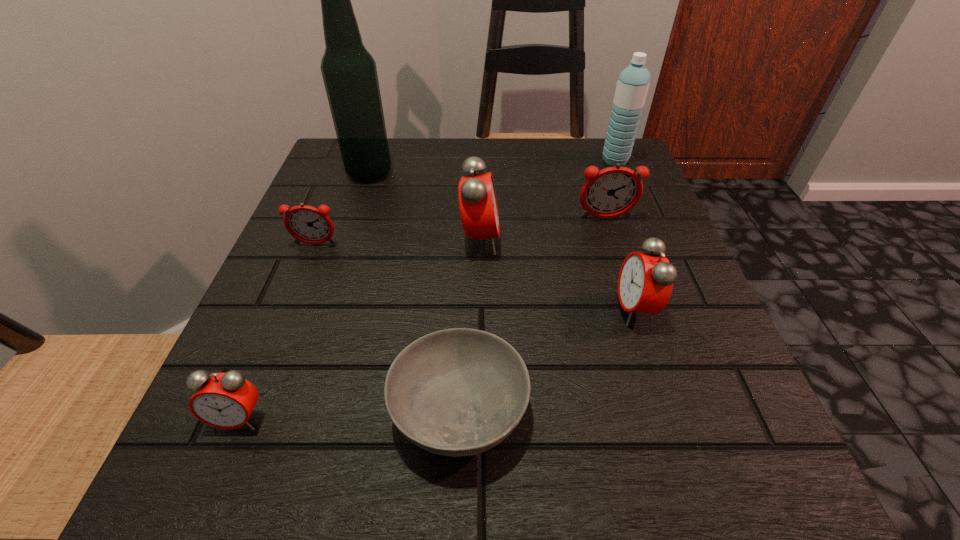
Locate an element on the screen. vacant position located 0.280m on the front-facing side of the third nearest object is located at coordinates (440, 309).

The height and width of the screenshot is (540, 960). Identify the location of vacant area situated 0.090m on the front-facing side of the third nearest object. (560, 309).

I want to click on blank space located 0.170m on the front-facing side of the nearer reddish-pink alarm clock, so click(x=285, y=321).

You are a GUI agent. You are given a task and a screenshot of the screen. Output one action in this format:
    pyautogui.click(x=<x>, y=<y>)
    Task: Click on the free space located on the back of the shortest object
    The image size is (960, 540).
    Given the screenshot: What is the action you would take?
    pyautogui.click(x=467, y=207)

This screenshot has width=960, height=540. Identify the location of alcohol that is at the far edge. (349, 72).

Where is `water bottle that is positioned at the far edge`? The image size is (960, 540). water bottle that is positioned at the far edge is located at coordinates (632, 86).

Identify the location of object that is at the near edge. The height and width of the screenshot is (540, 960). (455, 392).

The image size is (960, 540). I want to click on alcohol that is at the left edge, so click(349, 72).

Identify the location of water bottle at the right edge. The width and height of the screenshot is (960, 540). (632, 86).

This screenshot has width=960, height=540. What are the coordinates of `object situated at the far left corner` in the screenshot? It's located at (349, 72).